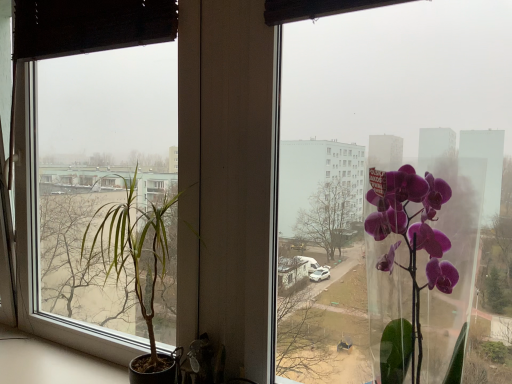
Question: Does green leafy plant at left have a larger size compared to transparent glass window at center?

Choices:
 (A) no
 (B) yes

Answer: (B)

Question: Are green leafy plant at left and transparent glass window at center far apart?

Choices:
 (A) no
 (B) yes

Answer: (B)

Question: Does green leafy plant at left have a lesser height compared to transparent glass window at center?

Choices:
 (A) yes
 (B) no

Answer: (B)

Question: From the image's perspective, is green leafy plant at left located beneath transparent glass window at center?

Choices:
 (A) no
 (B) yes

Answer: (B)

Question: From the image's perspective, is green leafy plant at left on top of transparent glass window at center?

Choices:
 (A) no
 (B) yes

Answer: (A)

Question: Is green leafy plant at left wider than transparent glass window at center?

Choices:
 (A) yes
 (B) no

Answer: (A)

Question: From the image's perspective, is transparent glass window at center beneath green leafy plant at left?

Choices:
 (A) yes
 (B) no

Answer: (B)

Question: From a real-world perspective, is transparent glass window at center located higher than green leafy plant at left?

Choices:
 (A) yes
 (B) no

Answer: (A)

Question: Could you tell me if transparent glass window at center is turned towards green leafy plant at left?

Choices:
 (A) no
 (B) yes

Answer: (A)

Question: Is transparent glass window at center wider than green leafy plant at left?

Choices:
 (A) yes
 (B) no

Answer: (B)

Question: Can you confirm if transparent glass window at center is thinner than green leafy plant at left?

Choices:
 (A) yes
 (B) no

Answer: (A)

Question: Is transparent glass window at center to the right of green leafy plant at left from the viewer's perspective?

Choices:
 (A) no
 (B) yes

Answer: (B)

Question: Are transparent glass window at center and transparent glass vase at right far apart?

Choices:
 (A) no
 (B) yes

Answer: (B)